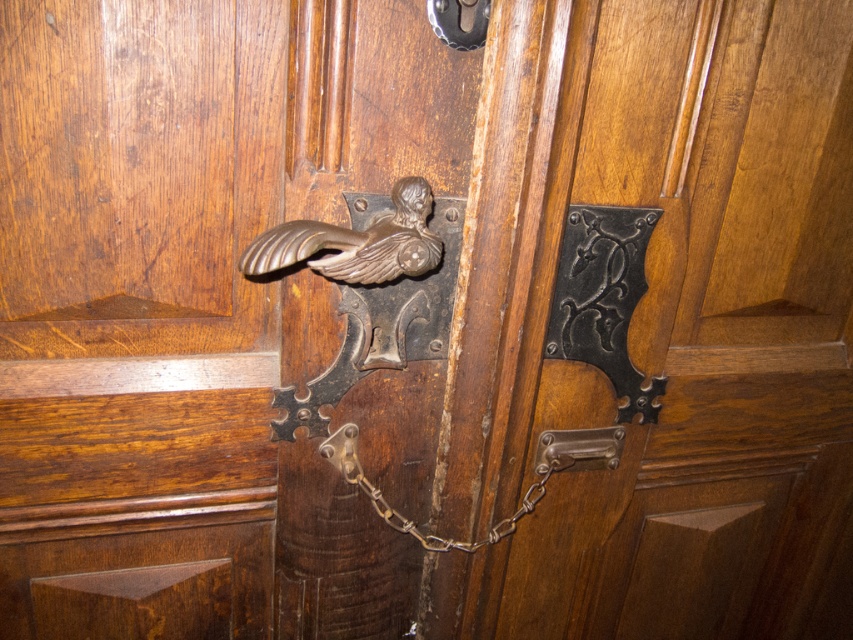
You are standing in front of the wooden door and want to grasp the polished brass handle at center. Based on the distance provided, can you reach it comfortably?

The polished brass handle at center is 23.65 inches from viewer, which is within comfortable reaching distance for most adults, so yes.

You are trying to open the door and need to identify which object is larger between the polished brass handle at center and the bronze polished bird at center. Which one should you grab if you need a larger handle?

The polished brass handle at center is bigger than the bronze polished bird at center, so you should grab the polished brass handle at center.